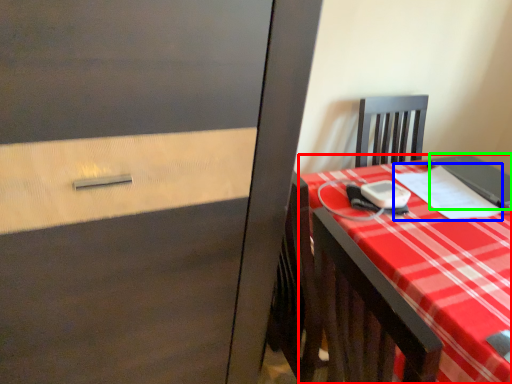
Question: Which is nearer to the desk (highlighted by a red box)? notebook (highlighted by a blue box) or notebook (highlighted by a green box).

Choices:
 (A) notebook
 (B) notebook

Answer: (A)